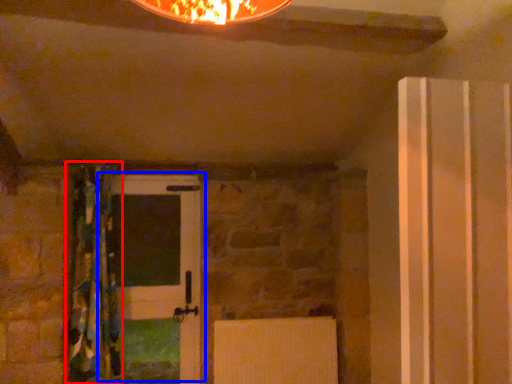
Question: Among these objects, which one is nearest to the camera, curtain (highlighted by a red box) or door (highlighted by a blue box)?

Choices:
 (A) curtain
 (B) door

Answer: (A)